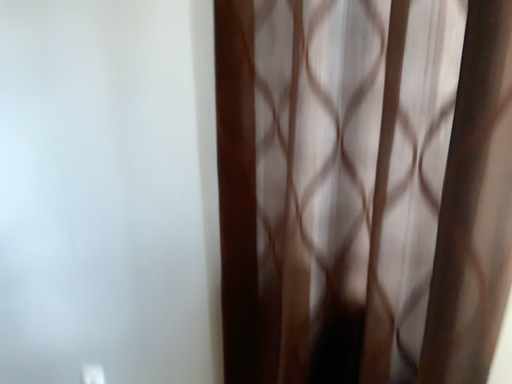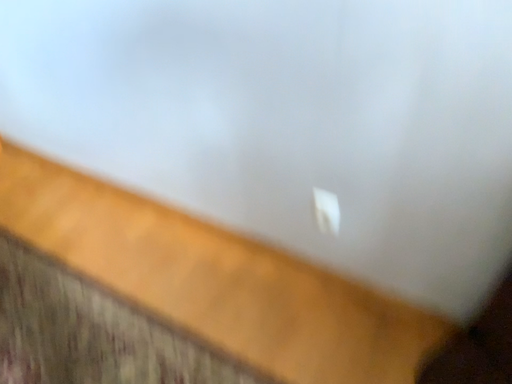
Question: How did the camera likely rotate when shooting the video?

Choices:
 (A) rotated upward
 (B) rotated downward

Answer: (B)